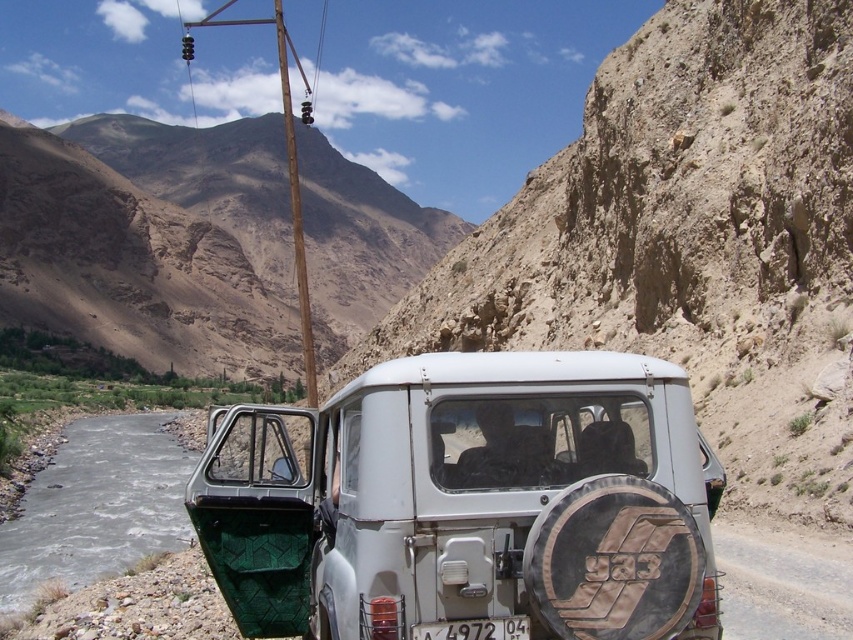
You are standing at the point labeled point [198,264] and want to walk to the point labeled point [283,22]. Which direction should you face to walk towards your destination?

You should face towards the left direction to walk towards point [283,22] from point [198,264].

You are a hiker planning to take a photo of the dull brown rock at upper center and the brown wooden telegraph pole at upper center. Which object should you focus on first if you want to capture both in a single frame without moving the camera?

You should focus on the dull brown rock at upper center first because it is wider than the brown wooden telegraph pole at upper center, so capturing its width ensures both objects fit in the frame.